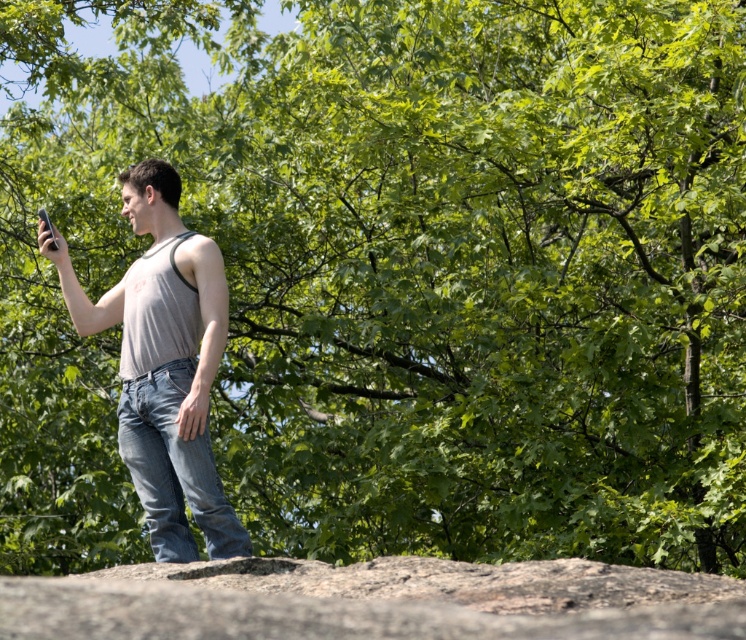
You are a photographer trying to capture a clear shot of the smooth gray rock at center without the gray cotton tank top at center blocking it. Based on their positions, can you adjust your angle to achieve this?

The smooth gray rock at center is in front of the gray cotton tank top at center, so adjusting your angle slightly might allow you to frame the shot so the rock is visible without the tank top blocking it.

The man in the image is holding a matte black phone at upper left and wearing a gray cotton tank top at center. Which item is positioned higher in the scene?

The matte black phone at upper left is positioned higher than the gray cotton tank top at center.

You are a photographer trying to capture the man in the scene. Since the gray cotton tank top at center and the matte black phone at upper left are in your viewfinder, which object should you focus on to ensure the man is the main subject?

The gray cotton tank top at center is much taller than the matte black phone at upper left, so focusing on the gray cotton tank top at center will ensure the man is the main subject.